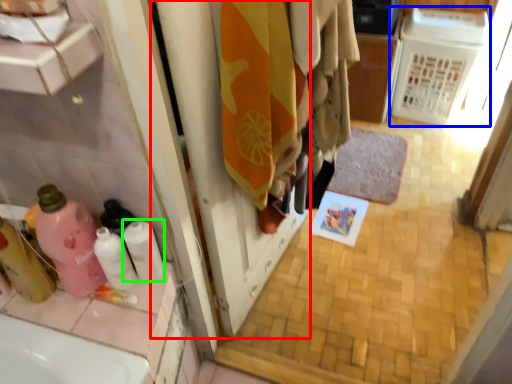
Question: Which object is positioned closest to screen door (highlighted by a red box)? Select from appliance (highlighted by a blue box) and toilet paper (highlighted by a green box).

Choices:
 (A) appliance
 (B) toilet paper

Answer: (B)